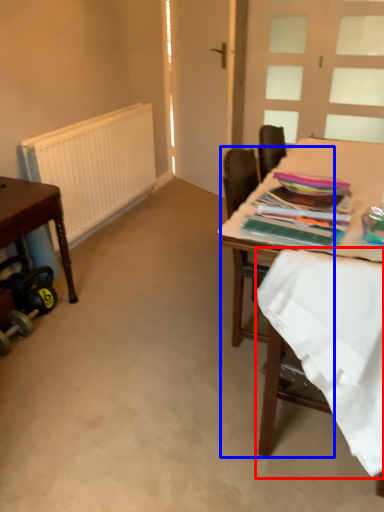
Question: Which object appears closest to the camera in this image, fabric (highlighted by a red box) or chair (highlighted by a blue box)?

Choices:
 (A) fabric
 (B) chair

Answer: (A)